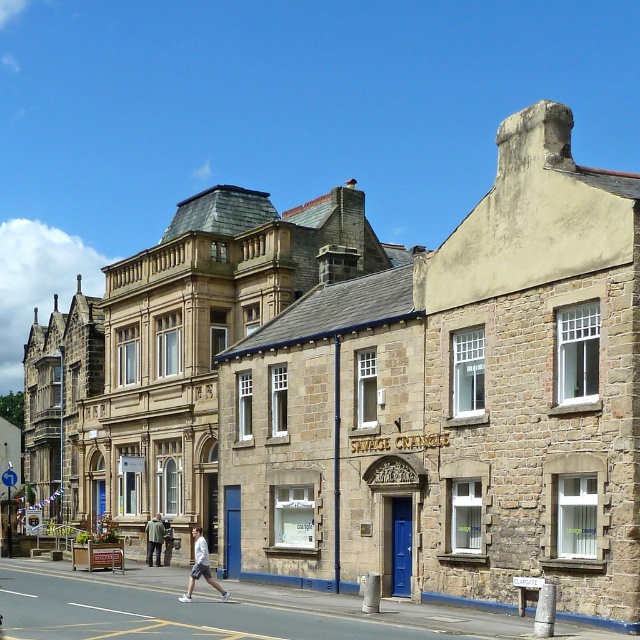
Between khaki fabric jacket at center and light gray fabric jacket at center, which one has more height?

Standing taller between the two is light gray fabric jacket at center.

Who is more distant from viewer, (156, 557) or (172, 544)?

Point (172, 544)

Describe the element at coordinates (154, 538) in the screenshot. I see `khaki fabric jacket at center` at that location.

Find the location of a particular element. Image resolution: width=640 pixels, height=640 pixels. khaki fabric jacket at center is located at coordinates (154, 538).

Who is positioned more to the right, light gray cotton shorts at center or khaki fabric jacket at center?

Positioned to the right is light gray cotton shorts at center.

Is point (189, 593) positioned behind point (150, 548)?

No, (189, 593) is in front of (150, 548).

In order to click on light gray cotton shorts at center in this screenshot , I will do `click(200, 566)`.

Where is `light gray cotton shorts at center`? Image resolution: width=640 pixels, height=640 pixels. light gray cotton shorts at center is located at coordinates (200, 566).

Which is in front, point (205, 564) or point (164, 532)?

Point (205, 564) is in front.

Which is in front, point (214, 580) or point (163, 524)?

Point (214, 580)

The height and width of the screenshot is (640, 640). I want to click on light gray cotton shorts at center, so click(200, 566).